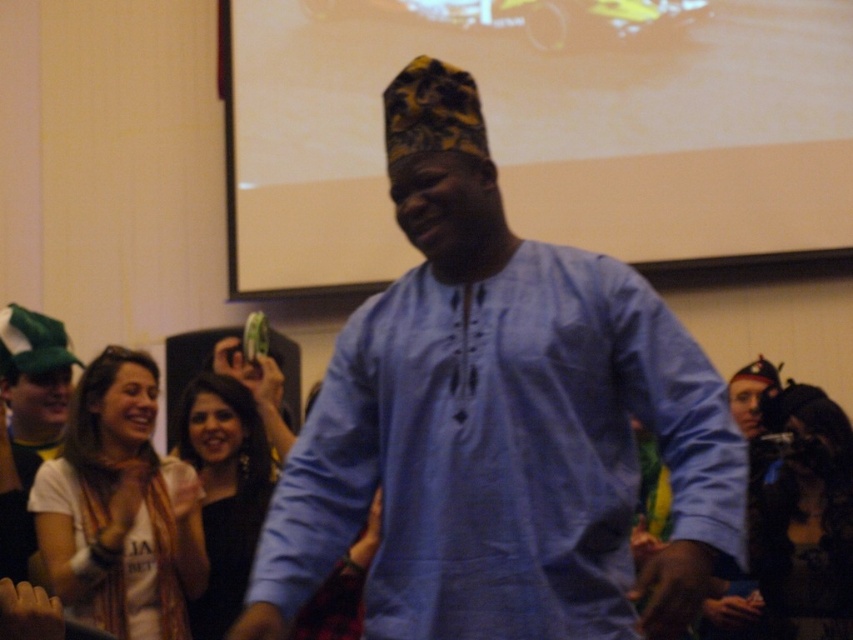
Based on the photo, you are a photographer at the event and want to capture a photo of both the white matte projection screen at upper center and the green fabric hat at left. Based on their positions, which object should you focus on first to ensure both are in frame?

The white matte projection screen at upper center is positioned on the right side of green fabric hat at left, so you should focus on the green fabric hat at left first to ensure both are in frame.

You are planning to hang a poster that is 1.2 meters wide on the wall where the white matte projection screen at upper center and the black satin dress at center are located. Based on their sizes, can you determine if the poster will fit horizontally between them?

The white matte projection screen at upper center is wider than the black satin dress at center. Since the poster is 1.2 meters wide, and the screen is wider than the dress, but we don not have exact measurements, it is uncertain if the poster will fit horizontally between them. More information is needed.